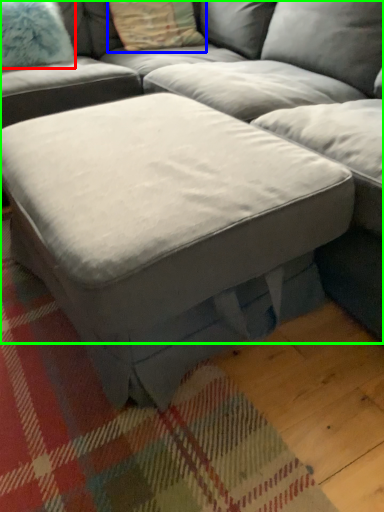
Question: Which is farther away from pillow (highlighted by a red box)? pillow (highlighted by a blue box) or studio couch (highlighted by a green box)?

Choices:
 (A) pillow
 (B) studio couch

Answer: (B)